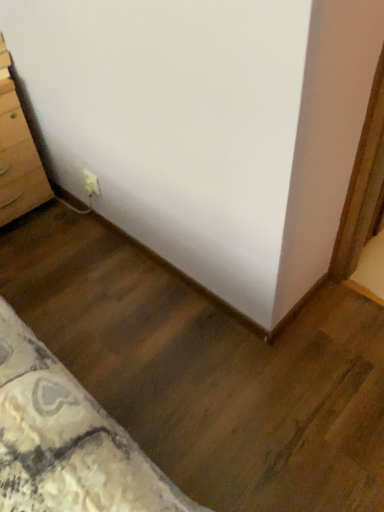
Question: Considering the relative positions of light brown wooden chest of drawers at left and white plastic outlet at lower left in the image provided, is light brown wooden chest of drawers at left to the left of white plastic outlet at lower left from the viewer's perspective?

Choices:
 (A) yes
 (B) no

Answer: (A)

Question: From a real-world perspective, is light brown wooden chest of drawers at left beneath white plastic outlet at lower left?

Choices:
 (A) yes
 (B) no

Answer: (B)

Question: Considering the relative sizes of light brown wooden chest of drawers at left and white plastic outlet at lower left in the image provided, is light brown wooden chest of drawers at left smaller than white plastic outlet at lower left?

Choices:
 (A) no
 (B) yes

Answer: (A)

Question: Considering the relative sizes of light brown wooden chest of drawers at left and white plastic outlet at lower left in the image provided, is light brown wooden chest of drawers at left taller than white plastic outlet at lower left?

Choices:
 (A) yes
 (B) no

Answer: (A)

Question: Is light brown wooden chest of drawers at left facing away from white plastic outlet at lower left?

Choices:
 (A) yes
 (B) no

Answer: (B)

Question: From the image's perspective, would you say light brown wooden chest of drawers at left is shown under white plastic outlet at lower left?

Choices:
 (A) no
 (B) yes

Answer: (A)

Question: Can you confirm if white plastic outlet at lower left is positioned to the right of light brown wooden chest of drawers at left?

Choices:
 (A) no
 (B) yes

Answer: (B)

Question: From the image's perspective, is white plastic outlet at lower left above light brown wooden chest of drawers at left?

Choices:
 (A) yes
 (B) no

Answer: (B)

Question: Does white plastic outlet at lower left have a larger size compared to light brown wooden chest of drawers at left?

Choices:
 (A) no
 (B) yes

Answer: (A)

Question: From a real-world perspective, is white plastic outlet at lower left physically below light brown wooden chest of drawers at left?

Choices:
 (A) yes
 (B) no

Answer: (A)

Question: Does white plastic outlet at lower left have a greater width compared to light brown wooden chest of drawers at left?

Choices:
 (A) no
 (B) yes

Answer: (A)

Question: Considering the relative sizes of white plastic outlet at lower left and light brown wooden chest of drawers at left in the image provided, is white plastic outlet at lower left shorter than light brown wooden chest of drawers at left?

Choices:
 (A) yes
 (B) no

Answer: (A)

Question: Is point (3, 52) positioned closer to the camera than point (87, 188)?

Choices:
 (A) farther
 (B) closer

Answer: (B)